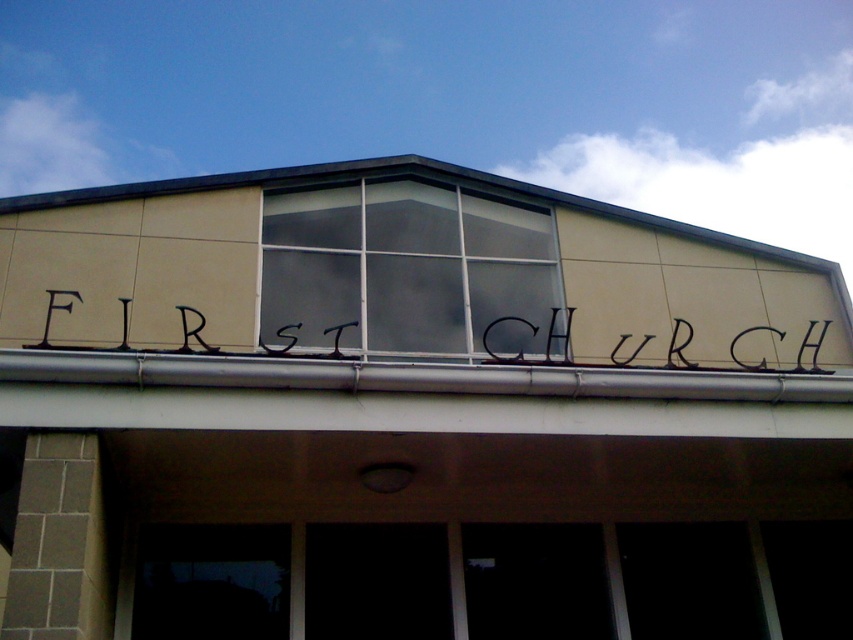
Between point (416, 330) and point (521, 358), which one is positioned in front?

Point (521, 358)

Looking at this image, does clear glass window at center have a larger size compared to black wrought iron sign at center?

Indeed, clear glass window at center has a larger size compared to black wrought iron sign at center.

Who is more distant from viewer, (x=300, y=296) or (x=347, y=324)?

Point (x=300, y=296)

Image resolution: width=853 pixels, height=640 pixels. What are the coordinates of `clear glass window at center` in the screenshot? It's located at (405, 269).

Does clear glass window at center appear on the right side of black metal sign at upper center?

In fact, clear glass window at center is to the left of black metal sign at upper center.

Does point (410, 179) come farther from viewer compared to point (619, 342)?

Yes.

Which is in front, point (399, 310) or point (798, 358)?

Positioned in front is point (798, 358).

I want to click on clear glass window at center, so click(x=405, y=269).

Which is below, black wrought iron sign at center or black metal sign at upper center?

black metal sign at upper center is lower down.

Between black wrought iron sign at center and black metal sign at upper center, which one is positioned higher?

Positioned higher is black wrought iron sign at center.

Does point (252, 355) come behind point (521, 317)?

No, it is not.

Identify the location of black wrought iron sign at center. (643, 346).